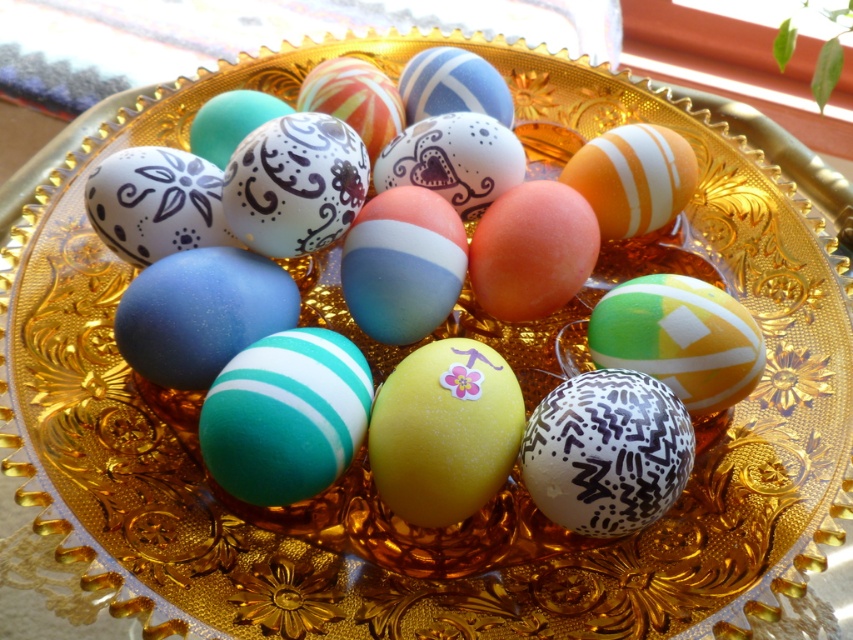
Question: Which object is farther from the camera taking this photo?

Choices:
 (A) matte green and white striped egg at center
 (B) yellow matte egg at center
 (C) orange matte egg at center
 (D) matte orange egg at center

Answer: (C)

Question: Which object is positioned closest to the matte green and white striped egg at center?

Choices:
 (A) yellow matte egg at center
 (B) orange matte egg at center

Answer: (B)

Question: Can you confirm if matte green and white striped egg at center is smaller than matte orange egg at center?

Choices:
 (A) no
 (B) yes

Answer: (A)

Question: Which point is farther to the camera?

Choices:
 (A) (665, 289)
 (B) (630, 216)
 (C) (553, 266)

Answer: (B)

Question: Is matte green and white striped egg at center positioned before orange matte egg at center?

Choices:
 (A) yes
 (B) no

Answer: (A)

Question: Is matte orange egg at center positioned behind orange matte egg at center?

Choices:
 (A) yes
 (B) no

Answer: (B)